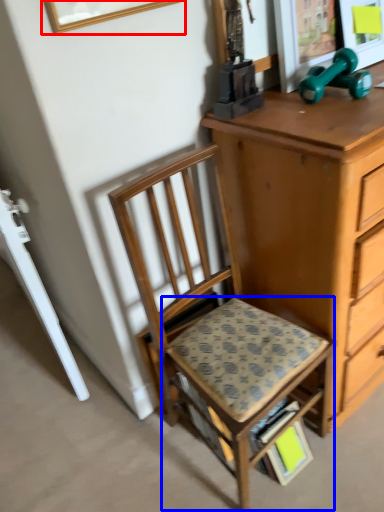
Question: Which object is further to the camera taking this photo, picture frame (highlighted by a red box) or step stool (highlighted by a blue box)?

Choices:
 (A) picture frame
 (B) step stool

Answer: (B)